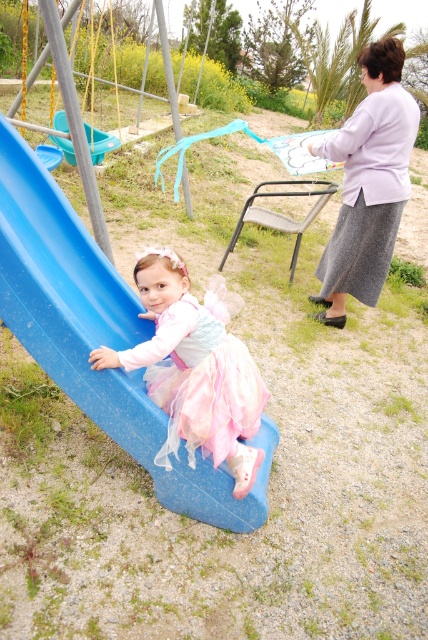
Is point (342, 148) closer to viewer compared to point (86, 128)?

Yes, point (342, 148) is in front of point (86, 128).

Does light purple fabric skirt at upper right have a larger size compared to teal plastic swing at upper left?

Indeed, light purple fabric skirt at upper right has a larger size compared to teal plastic swing at upper left.

Is point (383, 240) farther from camera compared to point (97, 163)?

No, (383, 240) is closer to viewer.

Identify the location of light purple fabric skirt at upper right. This screenshot has width=428, height=640. (368, 182).

In order to click on pastel tulle dress at lower left in this screenshot , I will do `click(204, 380)`.

Is pastel tulle dress at lower left positioned before teal plastic swing at upper left?

Yes, pastel tulle dress at lower left is in front of teal plastic swing at upper left.

The height and width of the screenshot is (640, 428). Identify the location of pastel tulle dress at lower left. (204, 380).

In order to click on pastel tulle dress at lower left in this screenshot , I will do `click(204, 380)`.

Is point (77, 282) less distant than point (374, 172)?

Yes, it is in front of point (374, 172).

Which is in front, point (101, 272) or point (382, 234)?

Point (101, 272)

Where is `blue plastic slide at left`? blue plastic slide at left is located at coordinates (95, 333).